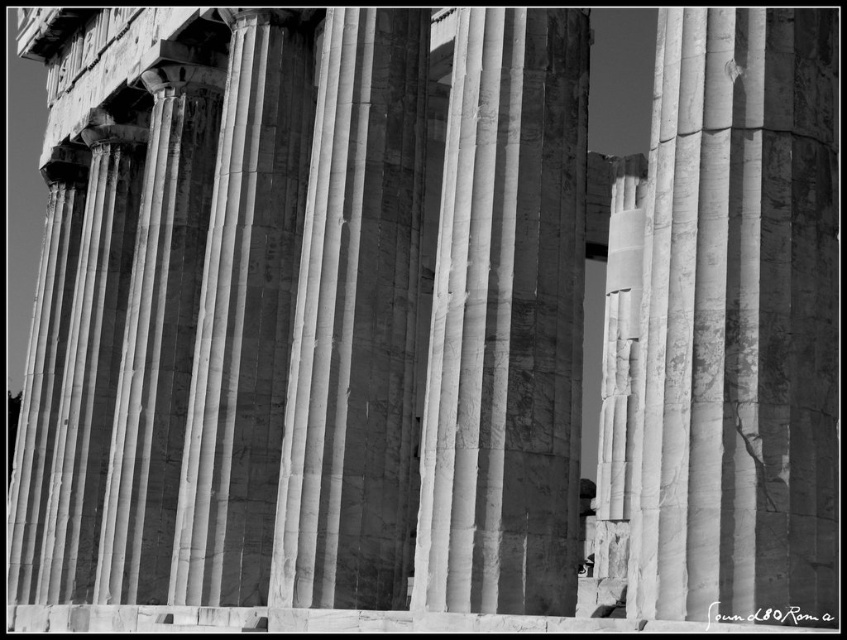
Can you confirm if marble column at center is positioned to the right of smooth marble column at center?

Yes, marble column at center is to the right of smooth marble column at center.

Does marble column at center have a larger size compared to smooth marble column at center?

Actually, marble column at center might be smaller than smooth marble column at center.

Who is more forward, (464, 381) or (294, 456)?

Point (464, 381)

The image size is (847, 640). Find the location of `marble column at center`. marble column at center is located at coordinates (507, 321).

Is marble column at center positioned at the back of white marble column at center?

No, marble column at center is closer to the viewer.

Can you confirm if marble column at center is positioned to the left of white marble column at center?

Incorrect, marble column at center is not on the left side of white marble column at center.

From the picture: Who is more forward, (472, 74) or (198, 380)?

Positioned in front is point (472, 74).

At what (x,y) coordinates should I click in order to perform the action: click on marble column at center. Please return your answer as a coordinate pair (x, y). This screenshot has height=640, width=847. Looking at the image, I should click on (507, 321).

Who is lower down, smooth marble column at center or white marble column at center?

Positioned lower is smooth marble column at center.

Is smooth marble column at center smaller than white marble column at center?

Yes.

Who is more forward, (307, 548) or (230, 52)?

Point (307, 548) is more forward.

I want to click on smooth marble column at center, so click(355, 321).